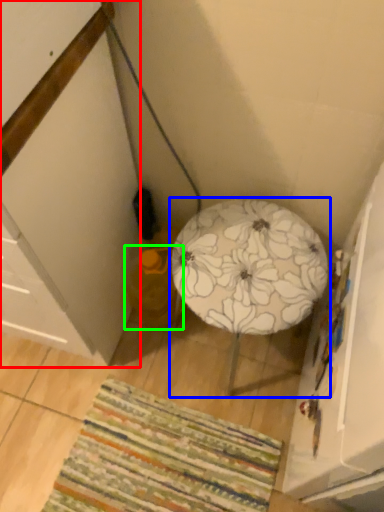
Question: Considering the real-world distances, which object is farthest from cabinetry (highlighted by a red box)? furniture (highlighted by a blue box) or bean bag chair (highlighted by a green box)?

Choices:
 (A) furniture
 (B) bean bag chair

Answer: (A)